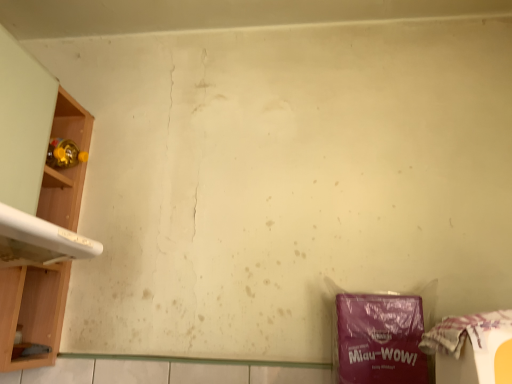
Question: Considering the relative sizes of white glossy washing machine at left and plastic bag at lower right in the image provided, is white glossy washing machine at left smaller than plastic bag at lower right?

Choices:
 (A) no
 (B) yes

Answer: (A)

Question: Does white glossy washing machine at left have a greater height compared to plastic bag at lower right?

Choices:
 (A) no
 (B) yes

Answer: (B)

Question: Considering the relative sizes of white glossy washing machine at left and plastic bag at lower right in the image provided, is white glossy washing machine at left wider than plastic bag at lower right?

Choices:
 (A) no
 (B) yes

Answer: (B)

Question: Is white glossy washing machine at left positioned far away from plastic bag at lower right?

Choices:
 (A) yes
 (B) no

Answer: (B)

Question: From a real-world perspective, is white glossy washing machine at left on plastic bag at lower right?

Choices:
 (A) no
 (B) yes

Answer: (B)

Question: Relative to plastic bag at lower right, is purple matte plastic bag at lower right in front or behind?

Choices:
 (A) behind
 (B) front

Answer: (A)

Question: Is point (362, 347) positioned closer to the camera than point (500, 362)?

Choices:
 (A) closer
 (B) farther

Answer: (B)

Question: From their relative heights in the image, would you say purple matte plastic bag at lower right is taller or shorter than plastic bag at lower right?

Choices:
 (A) short
 (B) tall

Answer: (B)

Question: Visually, is purple matte plastic bag at lower right positioned to the left or to the right of plastic bag at lower right?

Choices:
 (A) right
 (B) left

Answer: (B)

Question: From a real-world perspective, is wooden shelf at left physically located above or below purple matte plastic bag at lower right?

Choices:
 (A) below
 (B) above

Answer: (B)

Question: Is point (2, 360) positioned closer to the camera than point (379, 344)?

Choices:
 (A) closer
 (B) farther

Answer: (B)

Question: Is wooden shelf at left in front of or behind purple matte plastic bag at lower right in the image?

Choices:
 (A) front
 (B) behind

Answer: (B)

Question: Considering the relative positions of wooden shelf at left and purple matte plastic bag at lower right in the image provided, is wooden shelf at left to the left or to the right of purple matte plastic bag at lower right?

Choices:
 (A) right
 (B) left

Answer: (B)

Question: Which is correct: wooden shelf at left is inside plastic bag at lower right, or outside of it?

Choices:
 (A) outside
 (B) inside

Answer: (A)

Question: Is wooden shelf at left taller or shorter than plastic bag at lower right?

Choices:
 (A) short
 (B) tall

Answer: (B)